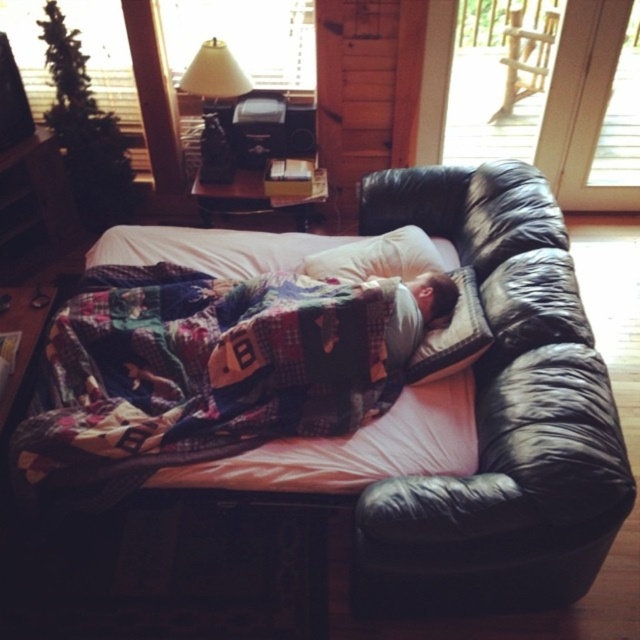
You are a guest in this cabin and want to turn on the matte black lamp at upper center to read a book. However, you are currently lying on the black leather couch at center. Can you reach the lamp without getting up?

The black leather couch at center is in front of the matte black lamp at upper center, meaning the couch is closer to you than the lamp. Since the lamp is on the side table to the left of the couch, you would need to get up to reach it.

You are a guest in this cabin and want to make sure you can comfortably sleep on the couch. The couch has the quilted fabric blanket at center and the white soft pillow at upper center. Which item is taller, so it might be more supportive for your head?

The quilted fabric blanket at center has a greater height compared to the white soft pillow at upper center, so it is taller and might provide better support for your head.